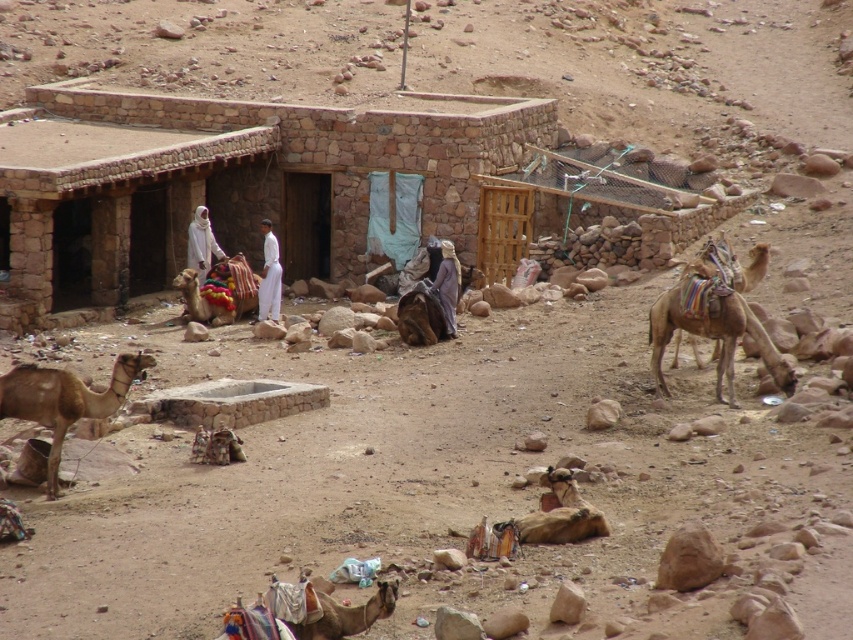
You are a traveler in the desert and need to decide whether to use the brown matte camel at lower left to carry your supplies. Considering the height of the white cloth at center, which is attached to a nearby structure, will the camel be able to comfortably pass under it?

The brown matte camel at lower left is shorter than the white cloth at center, so it should be able to pass under the cloth comfortably without any issues.

You are a traveler in the desert and need to decide whether your small backpack can fit between the multicolored fabric camel at lower center and the white cloth at center. The backpack is 0.5 meters wide. Can it fit?

The multicolored fabric camel at lower center might be wider than white cloth at center, so there may not be enough space for the backpack. It is uncertain if it can fit.